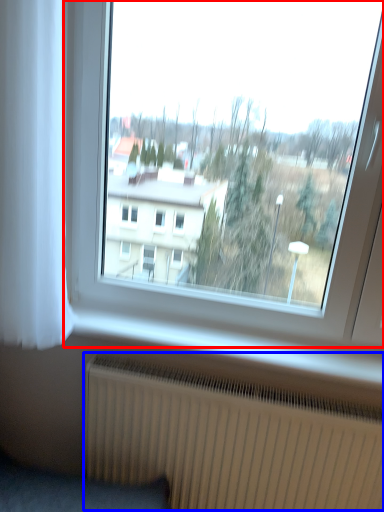
Question: Which of the following is the closest to the observer, window (highlighted by a red box) or radiator (highlighted by a blue box)?

Choices:
 (A) window
 (B) radiator

Answer: (A)